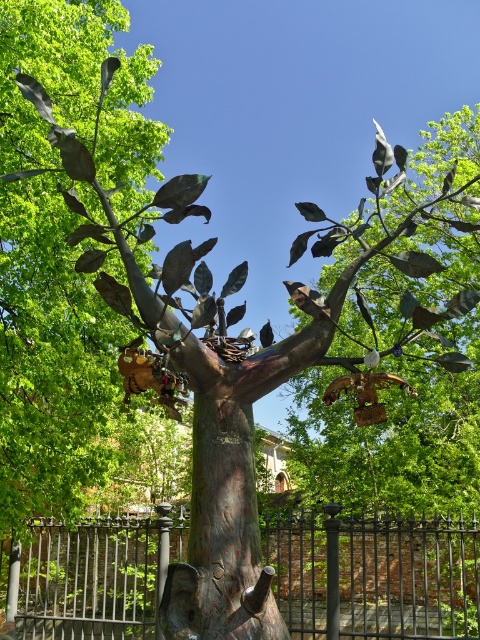
Which is below, black wrought iron fence at lower center or rustic wood tree trunk at center?

black wrought iron fence at lower center

Does black wrought iron fence at lower center have a smaller size compared to rustic wood tree trunk at center?

Indeed, black wrought iron fence at lower center has a smaller size compared to rustic wood tree trunk at center.

Is point (392, 596) behind point (254, 550)?

Yes, it is behind point (254, 550).

At what (x,y) coordinates should I click in order to perform the action: click on black wrought iron fence at lower center. Please return your answer as a coordinate pair (x, y). This screenshot has width=480, height=640. Looking at the image, I should click on (x=374, y=576).